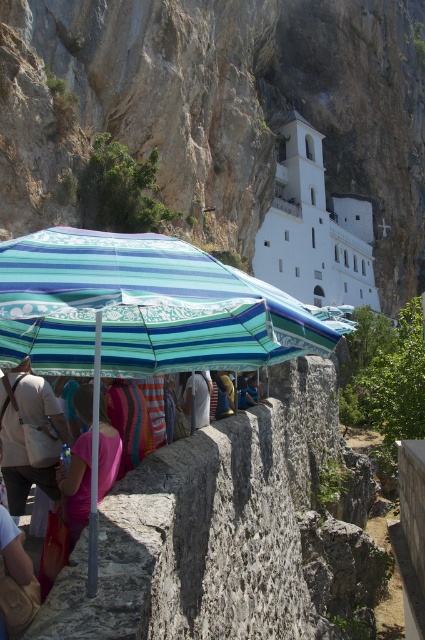
You are a tourist standing at the entrance of the white stone building at center. You want to join the group under the striped fabric umbrella at center. In which direction should you walk to reach the umbrella?

The striped fabric umbrella at center is positioned on the left side of the white stone building at center, so you should walk to the left to reach the umbrella.

You are a photographer trying to capture a photo of the tourists under the umbrella. You want to ensure both the light pink fabric bag at lower left and the white cotton shirt at center are clearly visible in the frame. Based on their positions, which object is closer to the left edge of the photo?

The light pink fabric bag at lower left is to the left of the white cotton shirt at center, so it is closer to the left edge of the photo.